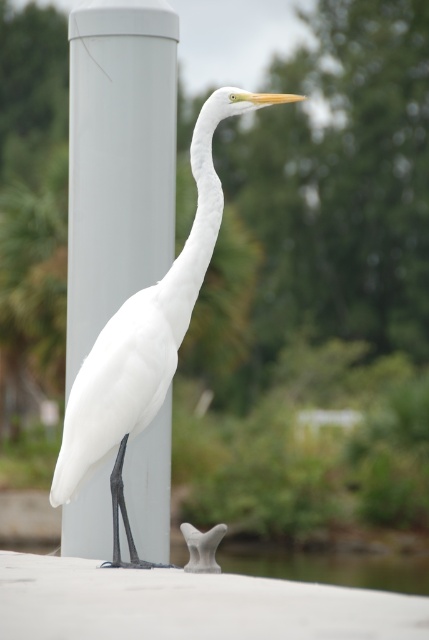
Question: Which point appears closest to the camera in this image?

Choices:
 (A) click(99, 378)
 (B) click(150, 198)

Answer: (A)

Question: From the image, what is the correct spatial relationship of white smooth pole at center in relation to white matte bird at center?

Choices:
 (A) above
 (B) below

Answer: (A)

Question: Does white smooth pole at center have a greater width compared to white matte bird at center?

Choices:
 (A) yes
 (B) no

Answer: (B)

Question: Is white smooth pole at center thinner than white matte bird at center?

Choices:
 (A) no
 (B) yes

Answer: (B)